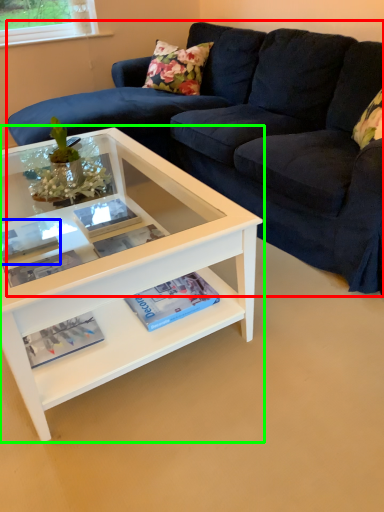
Question: Which object is positioned farthest from studio couch (highlighted by a red box)? Select from book (highlighted by a blue box) and coffee table (highlighted by a green box).

Choices:
 (A) book
 (B) coffee table

Answer: (A)